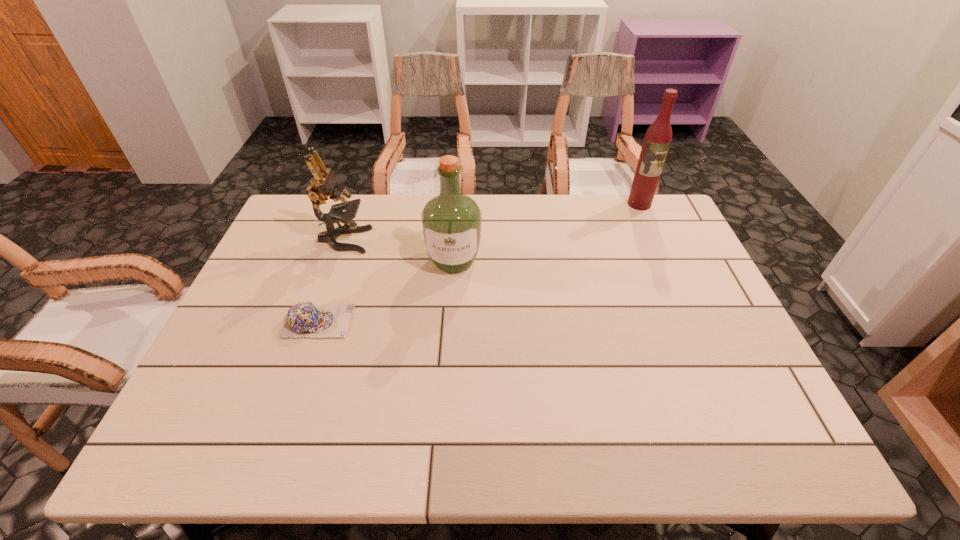
Locate an element on the screen. The width and height of the screenshot is (960, 540). vacant area situated 0.050m on the front, side, and top of the shortest object is located at coordinates (371, 321).

The height and width of the screenshot is (540, 960). I want to click on liquor at the far edge, so coord(658,137).

Identify the location of microscope that is at the far edge. The height and width of the screenshot is (540, 960). (323, 182).

Find the location of a particular element. This screenshot has height=540, width=960. microscope that is at the left edge is located at coordinates (323, 182).

This screenshot has height=540, width=960. I want to click on cap that is at the left edge, so click(304, 319).

Identify the location of object at the right edge. Image resolution: width=960 pixels, height=540 pixels. (658, 137).

You are a GUI agent. You are given a task and a screenshot of the screen. Output one action in this format:
    pyautogui.click(x=<x>, y=<y>)
    Task: Click on the object that is positioned at the far left corner
    The image size is (960, 540).
    Given the screenshot: What is the action you would take?
    pyautogui.click(x=323, y=182)

Locate an element on the screen. The image size is (960, 540). object that is at the far right corner is located at coordinates (658, 137).

You are a GUI agent. You are given a task and a screenshot of the screen. Output one action in this format:
    pyautogui.click(x=<x>, y=<y>)
    Task: Click on the free location at the far edge of the desktop
    
    Given the screenshot: What is the action you would take?
    pyautogui.click(x=412, y=217)

The width and height of the screenshot is (960, 540). I want to click on vacant space at the near edge, so pos(311,426).